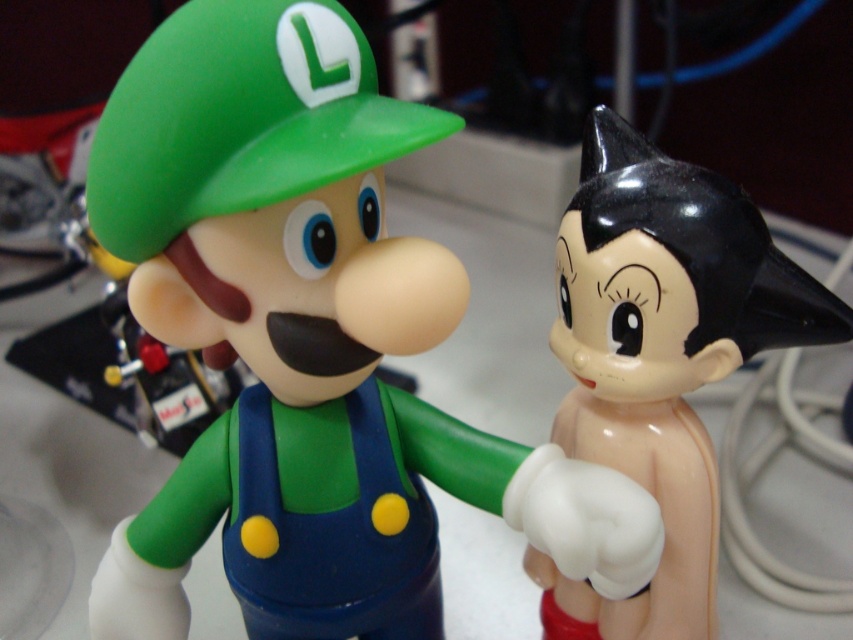
Is point (195, 314) in front of point (546, 634)?

Yes, point (195, 314) is closer to viewer.

Is matte plastic luigi figure at center to the left of glossy plastic figure at right from the viewer's perspective?

Yes, matte plastic luigi figure at center is to the left of glossy plastic figure at right.

Does point (119, 609) come behind point (662, 403)?

No, (119, 609) is closer to viewer.

Where is `matte plastic luigi figure at center`? matte plastic luigi figure at center is located at coordinates (308, 342).